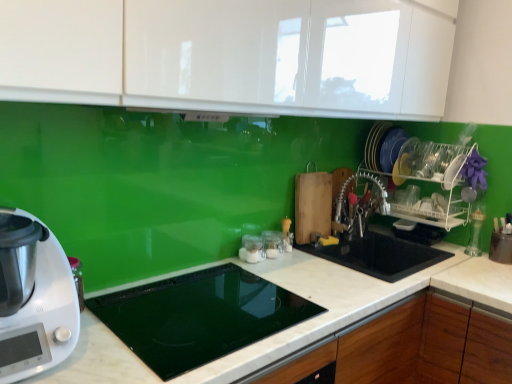
This screenshot has height=384, width=512. Identify the location of vacant area to the left of clear glass jar at center, marked as the 2th appliance in a back-to-front arrangement. (213, 266).